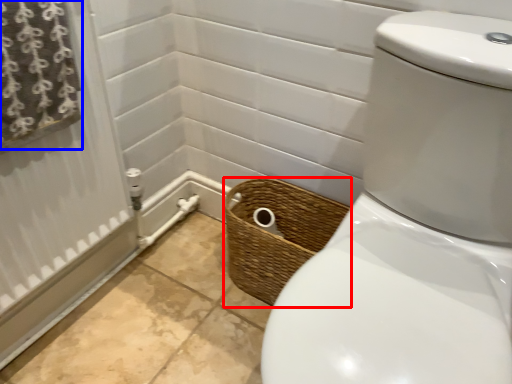
Question: Among these objects, which one is farthest to the camera, basket (highlighted by a red box) or curtain (highlighted by a blue box)?

Choices:
 (A) basket
 (B) curtain

Answer: (A)